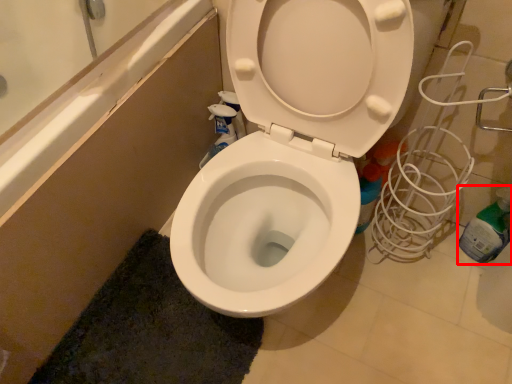
Question: From the image's perspective, where is bottle (annotated by the red box) located relative to bath mat?

Choices:
 (A) below
 (B) above

Answer: (B)